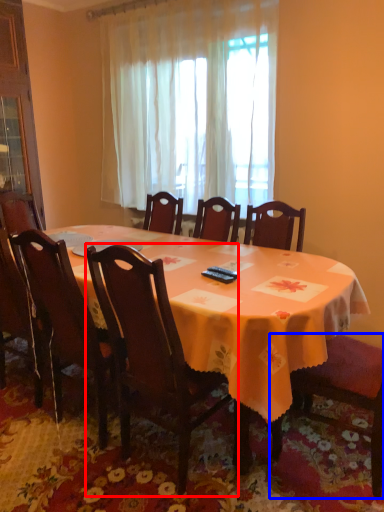
Question: Which point is closer to the camera, chair (highlighted by a red box) or chair (highlighted by a blue box)?

Choices:
 (A) chair
 (B) chair

Answer: (A)